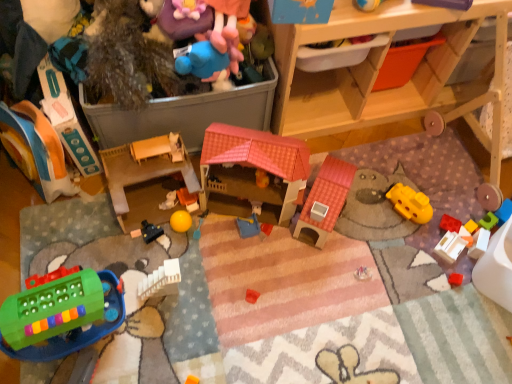
You are a GUI agent. You are given a task and a screenshot of the screen. Output one action in this format:
    pyautogui.click(x=<x>, y=<y>)
    Task: Click on the free spot to the right of blue plastic toy at center, which is the fifth toy from right to left
    The height and width of the screenshot is (384, 512).
    Given the screenshot: What is the action you would take?
    pyautogui.click(x=290, y=246)